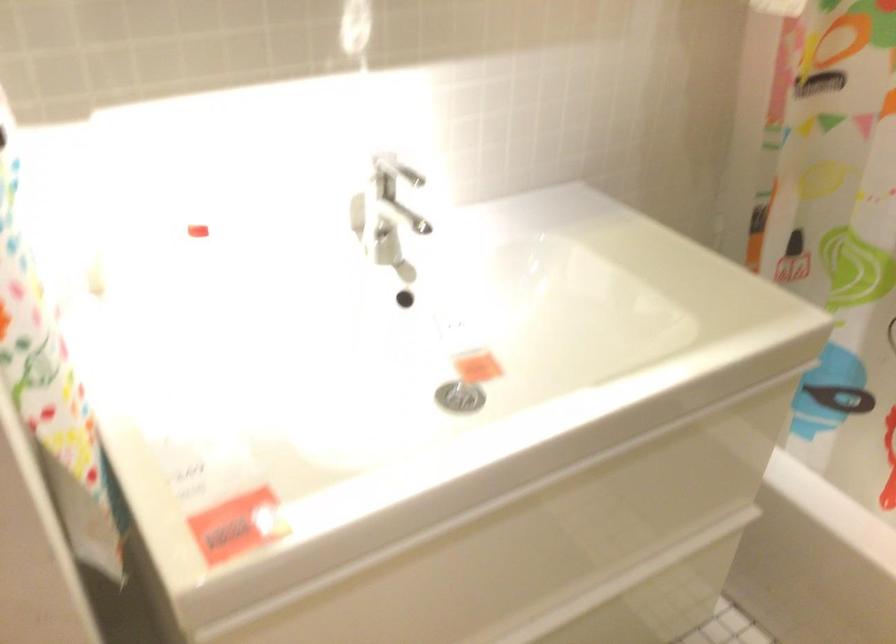
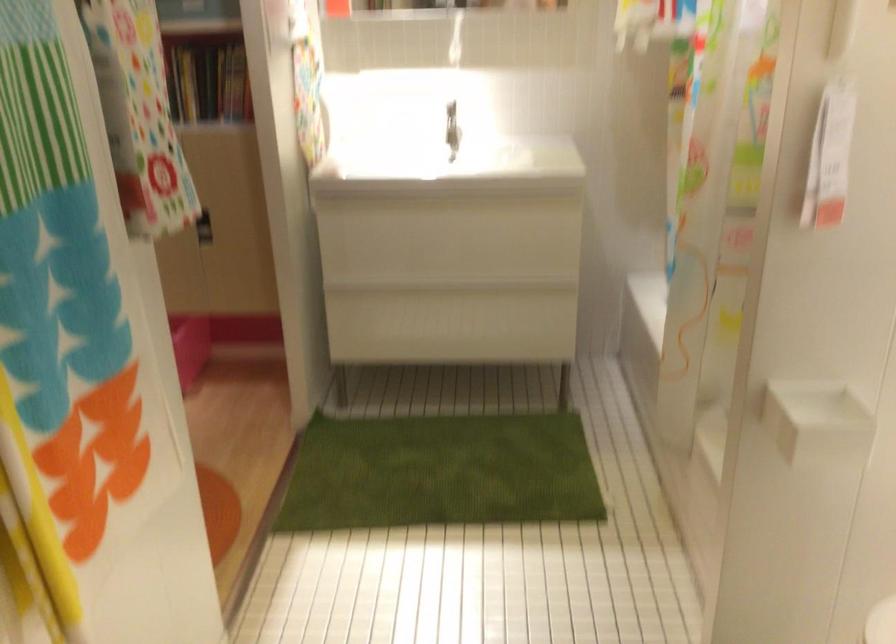
Where in the second image is the point corresponding to the point at 546,486 from the first image?

(440, 201)